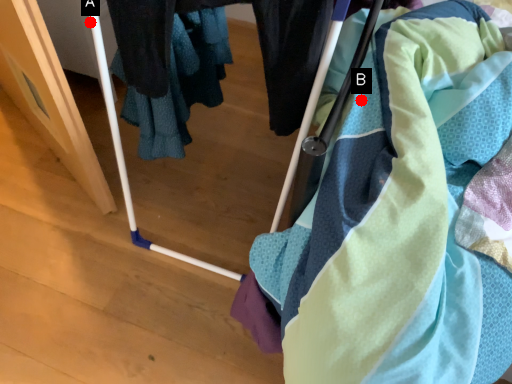
Question: Two points are circled on the image, labeled by A and B beside each circle. Which point is farther from the camera taking this photo?

Choices:
 (A) A is further
 (B) B is further

Answer: (A)